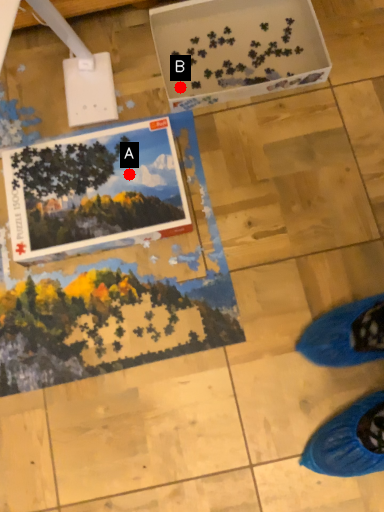
Question: Two points are circled on the image, labeled by A and B beside each circle. Among these points, which one is nearest to the camera?

Choices:
 (A) A is closer
 (B) B is closer

Answer: (A)